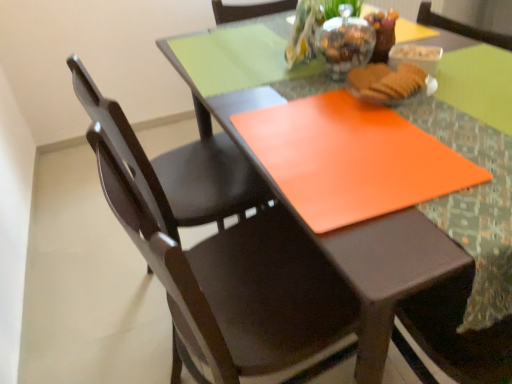
You are a GUI agent. You are given a task and a screenshot of the screen. Output one action in this format:
    pyautogui.click(x=<x>, y=<y>)
    Task: Click on the orange matte placemat at center
    The height and width of the screenshot is (384, 512).
    Given the screenshot: What is the action you would take?
    pyautogui.click(x=351, y=159)

What is the approximate width of matte dark wood chair at center, placed as the 2th chair when sorted from back to front?

matte dark wood chair at center, placed as the 2th chair when sorted from back to front, is 18.42 inches in width.

Measure the distance between translucent glass vase at upper center and camera.

They are 90.60 centimeters apart.

What do you see at coordinates (178, 168) in the screenshot?
I see `matte dark wood chair at left, which is the first chair in back-to-front order` at bounding box center [178, 168].

Where is `matte brown biscuit at center`? matte brown biscuit at center is located at coordinates (385, 82).

Can you tell me how much matte brown biscuit at center and matte dark wood chair at center, the 1th chair in the front-to-back sequence, differ in facing direction?

2.68 degrees separate the facing orientations of matte brown biscuit at center and matte dark wood chair at center, the 1th chair in the front-to-back sequence.

Do you think matte brown biscuit at center is within matte dark wood chair at center, the 1th chair in the front-to-back sequence, or outside of it?

matte brown biscuit at center is not enclosed by matte dark wood chair at center, the 1th chair in the front-to-back sequence.

Does point (424, 78) come in front of point (294, 233)?

That is True.

From the image's perspective, who appears lower, matte brown biscuit at center or matte dark wood chair at center, placed as the 2th chair when sorted from back to front?

matte dark wood chair at center, placed as the 2th chair when sorted from back to front, is shown below in the image.

What's the angular difference between matte dark wood chair at center, the 1th chair in the front-to-back sequence, and orange matte placemat at center's facing directions?

11.2 degrees separate the facing orientations of matte dark wood chair at center, the 1th chair in the front-to-back sequence, and orange matte placemat at center.

Measure the distance between matte dark wood chair at center, the 1th chair in the front-to-back sequence, and orange matte placemat at center.

matte dark wood chair at center, the 1th chair in the front-to-back sequence, is 23.68 centimeters from orange matte placemat at center.

Is matte dark wood chair at center, placed as the 2th chair when sorted from back to front, to the left or to the right of orange matte placemat at center in the image?

matte dark wood chair at center, placed as the 2th chair when sorted from back to front, is to the left of orange matte placemat at center.

From the picture: In terms of height, does matte dark wood chair at center, placed as the 2th chair when sorted from back to front, look taller or shorter compared to orange matte placemat at center?

matte dark wood chair at center, placed as the 2th chair when sorted from back to front, is taller than orange matte placemat at center.

Between translucent glass vase at upper center and matte dark wood chair at center, the 1th chair in the front-to-back sequence, which one has less height?

translucent glass vase at upper center is shorter.

Could you tell me if translucent glass vase at upper center is facing matte dark wood chair at center, the 1th chair in the front-to-back sequence?

No, translucent glass vase at upper center is not turned towards matte dark wood chair at center, the 1th chair in the front-to-back sequence.

Can you confirm if translucent glass vase at upper center is thinner than matte dark wood chair at center, placed as the 2th chair when sorted from back to front?

Yes.

From the image's perspective, relative to matte dark wood chair at center, placed as the 2th chair when sorted from back to front, is orange matte placemat at center above or below?

orange matte placemat at center is situated higher than matte dark wood chair at center, placed as the 2th chair when sorted from back to front, in the image.

How far apart are orange matte placemat at center and matte dark wood chair at center, placed as the 2th chair when sorted from back to front?

orange matte placemat at center is 10.94 inches away from matte dark wood chair at center, placed as the 2th chair when sorted from back to front.

Considering the positions of objects orange matte placemat at center and matte dark wood chair at center, the 1th chair in the front-to-back sequence, in the image provided, who is more to the right, orange matte placemat at center or matte dark wood chair at center, the 1th chair in the front-to-back sequence,?

orange matte placemat at center.

Are orange matte placemat at center and matte dark wood chair at center, the 1th chair in the front-to-back sequence, beside each other?

No, orange matte placemat at center is not making contact with matte dark wood chair at center, the 1th chair in the front-to-back sequence.

Between translucent glass vase at upper center and matte brown biscuit at center, which one has smaller size?

matte brown biscuit at center is smaller.

How many degrees apart are the facing directions of translucent glass vase at upper center and matte brown biscuit at center?

1.96 degrees separate the facing orientations of translucent glass vase at upper center and matte brown biscuit at center.

Is translucent glass vase at upper center at the left side of matte brown biscuit at center?

Yes.

Considering the relative positions of matte brown biscuit at center and orange matte placemat at center in the image provided, is matte brown biscuit at center to the right of orange matte placemat at center from the viewer's perspective?

Yes.

Which object is thinner, matte brown biscuit at center or orange matte placemat at center?

matte brown biscuit at center is thinner.

Is matte brown biscuit at center bigger or smaller than orange matte placemat at center?

matte brown biscuit at center is smaller than orange matte placemat at center.

From a real-world perspective, is matte brown biscuit at center below orange matte placemat at center?

Incorrect, from a real-world perspective, matte brown biscuit at center is higher than orange matte placemat at center.

Is matte brown biscuit at center far from orange matte placemat at center?

No.

Is matte brown biscuit at center oriented towards orange matte placemat at center?

No, matte brown biscuit at center is not facing towards orange matte placemat at center.

From the image's perspective, which one is positioned lower, matte brown biscuit at center or orange matte placemat at center?

orange matte placemat at center.

The width and height of the screenshot is (512, 384). I want to click on food above the matte dark wood chair at center, the 1th chair in the front-to-back sequence (from the image's perspective), so click(x=385, y=82).

Locate an element on the screen. chair that is the 2nd one below the orange matte placemat at center (from a real-world perspective) is located at coordinates (241, 286).

Estimate the real-world distances between objects in this image. Which object is closer to matte dark wood chair at center, placed as the 2th chair when sorted from back to front, translucent glass vase at upper center or matte dark wood chair at left, which is the first chair in back-to-front order?

matte dark wood chair at left, which is the first chair in back-to-front order, is closer to matte dark wood chair at center, placed as the 2th chair when sorted from back to front.

From the image, which object appears to be farther from matte brown biscuit at center, transparent glass jar at upper center or translucent glass vase at upper center?

The object further to matte brown biscuit at center is translucent glass vase at upper center.

From the image, which object appears to be farther from matte dark wood chair at center, the 1th chair in the front-to-back sequence, orange matte placemat at center or orange matte placemat at center?

orange matte placemat at center is further to matte dark wood chair at center, the 1th chair in the front-to-back sequence.

Which object lies nearer to the anchor point translucent glass vase at upper center, matte dark wood chair at center, the 1th chair in the front-to-back sequence, or matte dark wood chair at left, which is the first chair in back-to-front order?

matte dark wood chair at left, which is the first chair in back-to-front order, is positioned closer to the anchor translucent glass vase at upper center.

Looking at the image, which one is located closer to transparent glass jar at upper center, translucent glass vase at upper center or orange matte placemat at center?

translucent glass vase at upper center is positioned closer to the anchor transparent glass jar at upper center.

From the image, which object appears to be nearer to orange matte placemat at center, translucent glass vase at upper center or orange matte placemat at center?

orange matte placemat at center is closer to orange matte placemat at center.

From the picture: Based on their spatial positions, is orange matte placemat at center or translucent glass vase at upper center further from transparent glass jar at upper center?

Among the two, orange matte placemat at center is located further to transparent glass jar at upper center.

Which object lies further to the anchor point translucent glass vase at upper center, matte brown biscuit at center or transparent glass jar at upper center?

The object further to translucent glass vase at upper center is matte brown biscuit at center.

Locate an element on the screen. food between orange matte placemat at center and transparent glass jar at upper center along the z-axis is located at coordinates (385, 82).

Identify the location of floral arrangement between matte dark wood chair at left, which is the first chair in back-to-front order, and orange matte placemat at center. (317, 26).

At what (x,y) coordinates should I click in order to perform the action: click on round table between matte brown biscuit at center and matte dark wood chair at center, placed as the 2th chair when sorted from back to front, in the up-down direction. Please return your answer as a coordinate pair (x, y). The image size is (512, 384). Looking at the image, I should click on (307, 128).

At what (x,y) coordinates should I click in order to perform the action: click on round table that lies between orange matte placemat at center and matte dark wood chair at center, the 1th chair in the front-to-back sequence, from top to bottom. Please return your answer as a coordinate pair (x, y). The height and width of the screenshot is (384, 512). Looking at the image, I should click on (307, 128).